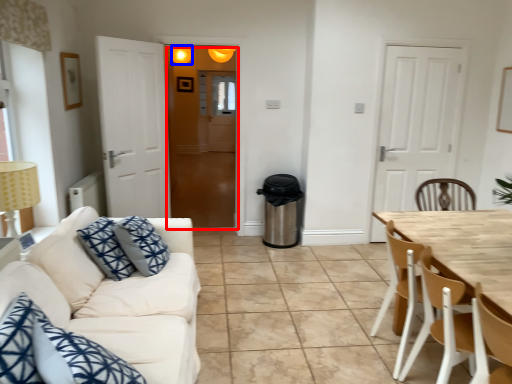
Question: Among these objects, which one is farthest to the camera, glass door (highlighted by a red box) or light fixture (highlighted by a blue box)?

Choices:
 (A) glass door
 (B) light fixture

Answer: (B)